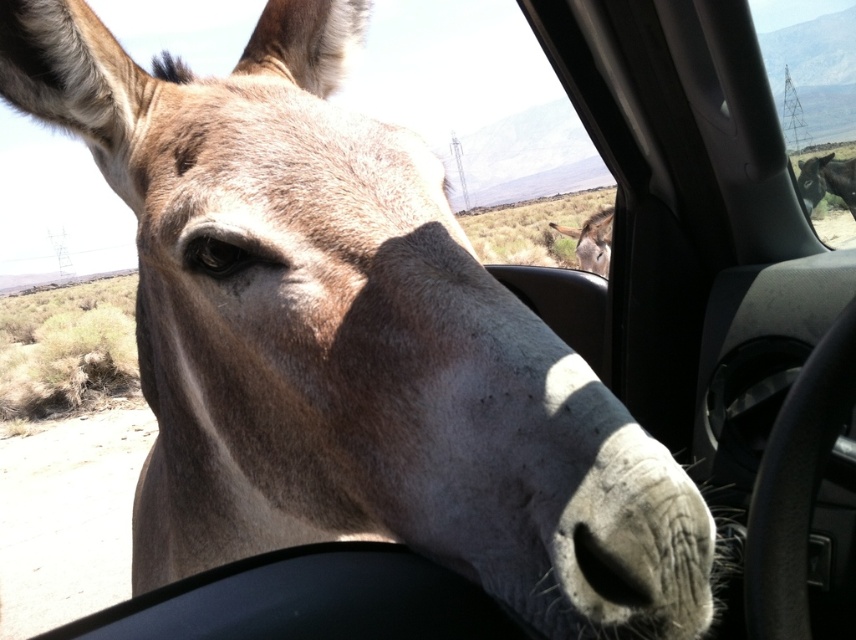
Question: Can you confirm if transparent glass donkey at upper right is positioned to the right of fuzzy brown mule at center?

Choices:
 (A) yes
 (B) no

Answer: (A)

Question: Does dark brown fur mule at upper right have a larger size compared to fuzzy brown mule at center?

Choices:
 (A) no
 (B) yes

Answer: (B)

Question: Which point appears farthest from the camera in this image?

Choices:
 (A) (813, 170)
 (B) (837, 20)

Answer: (B)

Question: Which object is the farthest from the fuzzy brown mule at center?

Choices:
 (A) transparent glass donkey at upper right
 (B) dark brown fur mule at upper right

Answer: (A)

Question: Which of the following is the closest to the observer?

Choices:
 (A) fuzzy brown mule at center
 (B) dark brown fur mule at upper right

Answer: (A)

Question: Considering the relative positions of transparent glass donkey at upper right and dark brown fur mule at upper right in the image provided, where is transparent glass donkey at upper right located with respect to dark brown fur mule at upper right?

Choices:
 (A) right
 (B) left

Answer: (B)